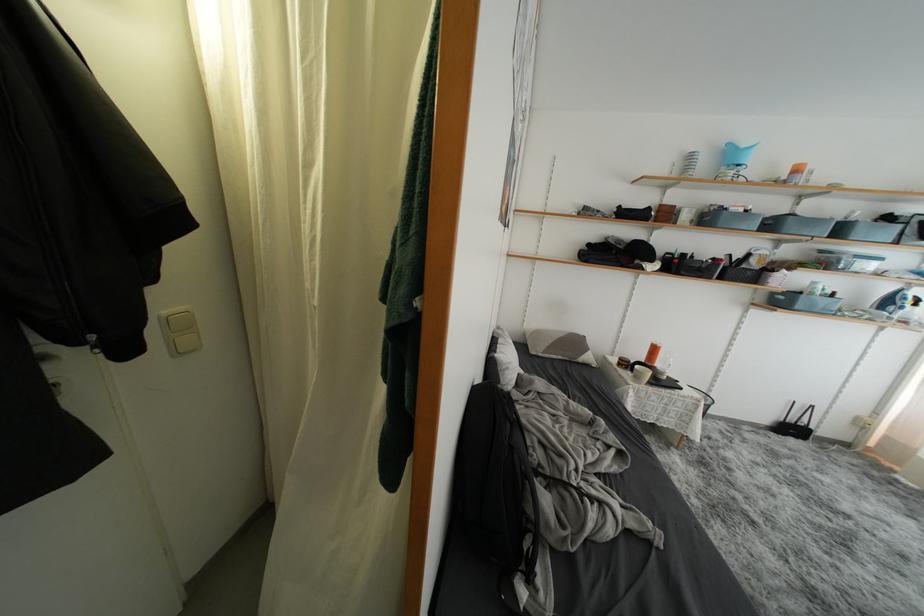
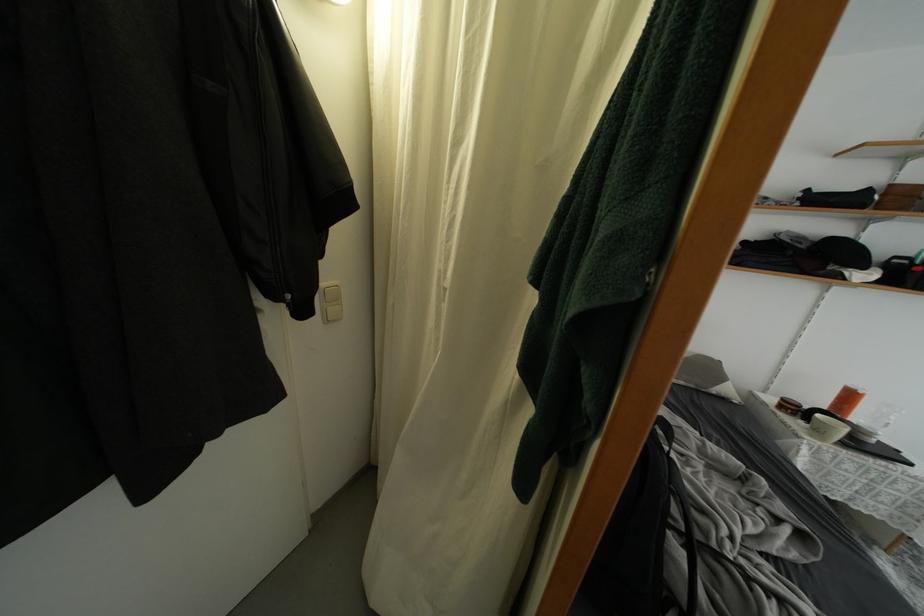
The point at (609, 426) is marked in the first image. Where is the corresponding point in the second image?

(769, 485)